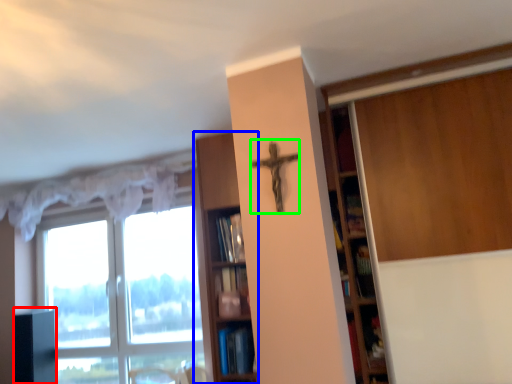
Question: Which object is the farthest from cabinetry (highlighted by a red box)? Choose among these: shelf (highlighted by a blue box) or crucifix (highlighted by a green box).

Choices:
 (A) shelf
 (B) crucifix

Answer: (B)